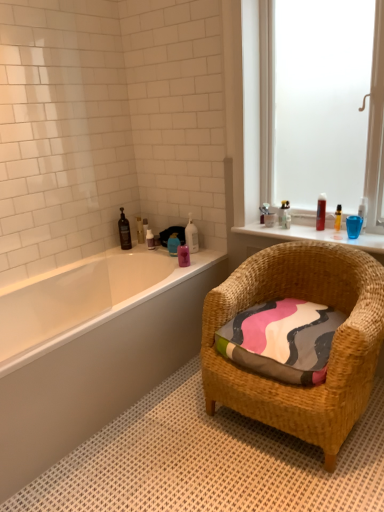
In order to click on free location to the left of woven wicker chair at lower right in this screenshot , I will do click(x=163, y=439).